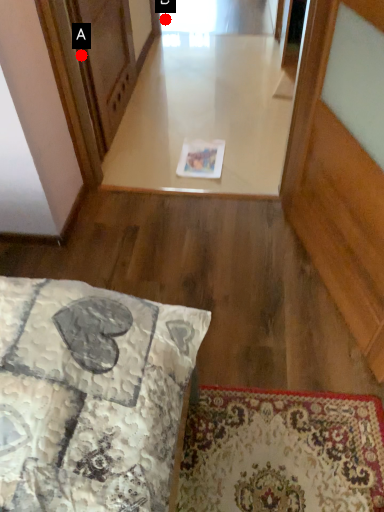
Question: Two points are circled on the image, labeled by A and B beside each circle. Which of the following is the closest to the observer?

Choices:
 (A) A is closer
 (B) B is closer

Answer: (A)